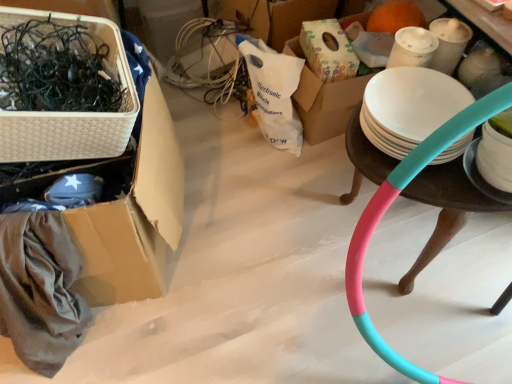
Find the location of `teal matte hula hoop at right`. teal matte hula hoop at right is located at coordinates (411, 182).

From a real-world perspective, is teal matte hula hoop at right positioned above or below white wicker basket at left?

teal matte hula hoop at right is below white wicker basket at left.

Does teal matte hula hoop at right have a lesser width compared to white wicker basket at left?

Indeed, teal matte hula hoop at right has a lesser width compared to white wicker basket at left.

Does point (355, 277) lie in front of point (162, 145)?

Yes, point (355, 277) is closer to viewer.

Identify the location of table that is behind the white wicker basket at upper left. (411, 182).

What's the angular difference between white wicker basket at upper left and teal matte hula hoop at right's facing directions?

There is a 2.66-degree angle between the facing directions of white wicker basket at upper left and teal matte hula hoop at right.

From the image's perspective, does white wicker basket at upper left appear higher than teal matte hula hoop at right?

Yes, from the image's perspective, white wicker basket at upper left is on top of teal matte hula hoop at right.

Who is taller, white wicker basket at upper left or teal matte hula hoop at right?

teal matte hula hoop at right.

Based on the photo, how many degrees apart are the facing directions of white matte plate at right and white wicker basket at upper left?

90.7 degrees separate the facing orientations of white matte plate at right and white wicker basket at upper left.

Which of these two, white matte plate at right or white wicker basket at upper left, stands taller?

With more height is white wicker basket at upper left.

Is point (466, 159) closer or farther from the camera than point (16, 139)?

Point (466, 159) is farther from the camera than point (16, 139).

Is white matte plate at right facing towards white wicker basket at upper left?

No, white matte plate at right is not facing towards white wicker basket at upper left.

From the image's perspective, would you say white matte plate at right is positioned over teal matte hula hoop at right?

Yes, from the image's perspective, white matte plate at right is above teal matte hula hoop at right.

Considering the sizes of objects white matte plate at right and teal matte hula hoop at right in the image provided, who is thinner, white matte plate at right or teal matte hula hoop at right?

Thinner between the two is white matte plate at right.

Considering the relative sizes of white matte plate at right and teal matte hula hoop at right in the image provided, is white matte plate at right bigger than teal matte hula hoop at right?

Incorrect, white matte plate at right is not larger than teal matte hula hoop at right.

Considering the positions of objects teal matte hula hoop at right and white wicker basket at upper left in the image provided, who is more to the left, teal matte hula hoop at right or white wicker basket at upper left?

white wicker basket at upper left is more to the left.

Relative to white wicker basket at upper left, is teal matte hula hoop at right in front or behind?

Clearly, teal matte hula hoop at right is behind white wicker basket at upper left.

From the image's perspective, which object appears higher, teal matte hula hoop at right or white wicker basket at upper left?

white wicker basket at upper left, from the image's perspective.

Would you say teal matte hula hoop at right is outside white wicker basket at upper left?

Indeed, teal matte hula hoop at right is completely outside white wicker basket at upper left.

From the picture: Is white wicker basket at left oriented towards white matte plate at right?

No, white wicker basket at left is not facing towards white matte plate at right.

Which object is more forward, white wicker basket at left or white matte plate at right?

white wicker basket at left is more forward.

From a real-world perspective, is white wicker basket at left above or below white matte plate at right?

From a real-world perspective, white wicker basket at left is physically below white matte plate at right.

Based on the photo, which of these two, white wicker basket at left or white matte plate at right, is bigger?

Bigger between the two is white wicker basket at left.

Between white wicker basket at upper left and white matte plate at right, which one is positioned behind?

white matte plate at right is behind.

Considering the relative positions of white wicker basket at upper left and white matte plate at right in the image provided, is white wicker basket at upper left to the right of white matte plate at right from the viewer's perspective?

Incorrect, white wicker basket at upper left is not on the right side of white matte plate at right.

From a real-world perspective, is white wicker basket at upper left positioned over white matte plate at right based on gravity?

Yes, from a real-world perspective, white wicker basket at upper left is above white matte plate at right.

In the image, there is a white wicker basket at left. Identify the location of table below it (from a real-world perspective). (411, 182).

The width and height of the screenshot is (512, 384). I want to click on basket on the left side of teal matte hula hoop at right, so click(69, 112).

Estimate the real-world distances between objects in this image. Which object is further from teal matte hula hoop at right, white wicker basket at left or white matte plate at right?

Based on the image, white wicker basket at left appears to be further to teal matte hula hoop at right.

When comparing their distances from teal matte hula hoop at right, does white matte plate at right or white wicker basket at upper left seem further?

white wicker basket at upper left is positioned further to the anchor teal matte hula hoop at right.

Which object lies further to the anchor point white matte plate at right, teal matte hula hoop at right or white wicker basket at upper left?

white wicker basket at upper left lies further to white matte plate at right than the other object.

When comparing their distances from white matte plate at right, does white wicker basket at upper left or white wicker basket at left seem closer?

white wicker basket at left is closer to white matte plate at right.

Looking at the image, which one is located further to white wicker basket at left, white matte plate at right or white wicker basket at upper left?

The object further to white wicker basket at left is white matte plate at right.

From the picture: From the image, which object appears to be farther from white wicker basket at left, white wicker basket at upper left or teal matte hula hoop at right?

Among the two, teal matte hula hoop at right is located further to white wicker basket at left.

Which object lies nearer to the anchor point white wicker basket at upper left, teal matte hula hoop at right or white matte plate at right?

teal matte hula hoop at right lies closer to white wicker basket at upper left than the other object.

When comparing their distances from white wicker basket at upper left, does white wicker basket at left or teal matte hula hoop at right seem further?

teal matte hula hoop at right is further to white wicker basket at upper left.

This screenshot has width=512, height=384. In order to click on plate located between white wicker basket at left and teal matte hula hoop at right in the left-right direction in this screenshot , I will do `click(481, 176)`.

At what (x,y) coordinates should I click in order to perform the action: click on basket situated between white wicker basket at left and white matte plate at right from left to right. Please return your answer as a coordinate pair (x, y). This screenshot has height=384, width=512. Looking at the image, I should click on (69, 112).

Where is `plate between white wicker basket at upper left and teal matte hula hoop at right in the horizontal direction`? This screenshot has height=384, width=512. plate between white wicker basket at upper left and teal matte hula hoop at right in the horizontal direction is located at coordinates (481, 176).

Image resolution: width=512 pixels, height=384 pixels. I want to click on basket between white wicker basket at left and teal matte hula hoop at right, so point(69,112).